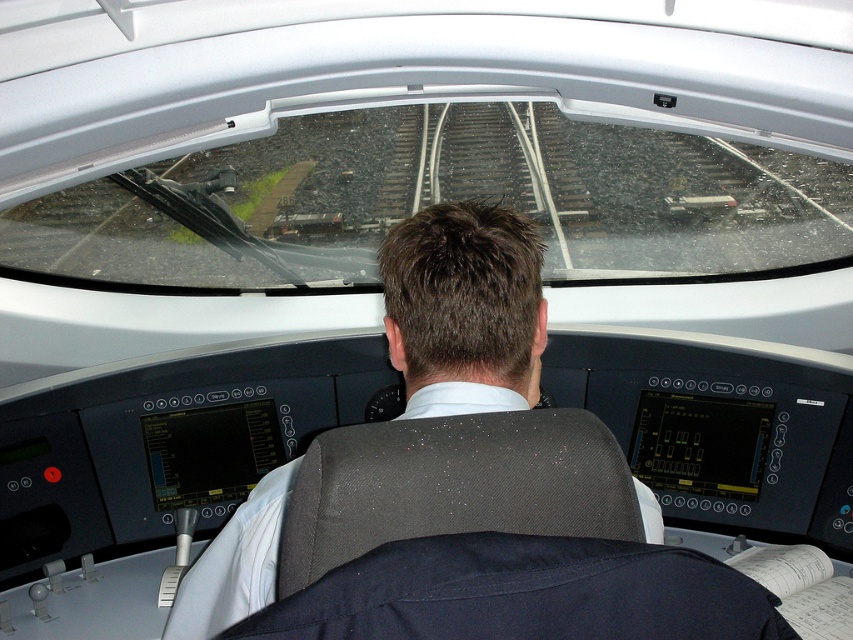
Question: Is dark blue fabric at center below dark gray fabric at center?

Choices:
 (A) no
 (B) yes

Answer: (A)

Question: Which of the following is the farthest from the observer?

Choices:
 (A) dark blue fabric at center
 (B) dark gray fabric at center

Answer: (B)

Question: Considering the relative positions of dark blue fabric at center and dark gray fabric at center in the image provided, where is dark blue fabric at center located with respect to dark gray fabric at center?

Choices:
 (A) right
 (B) left

Answer: (A)

Question: Can you confirm if dark blue fabric at center is positioned to the left of dark gray fabric at center?

Choices:
 (A) no
 (B) yes

Answer: (A)

Question: Which object is farther from the camera taking this photo?

Choices:
 (A) dark blue fabric at center
 (B) dark gray fabric at center

Answer: (B)